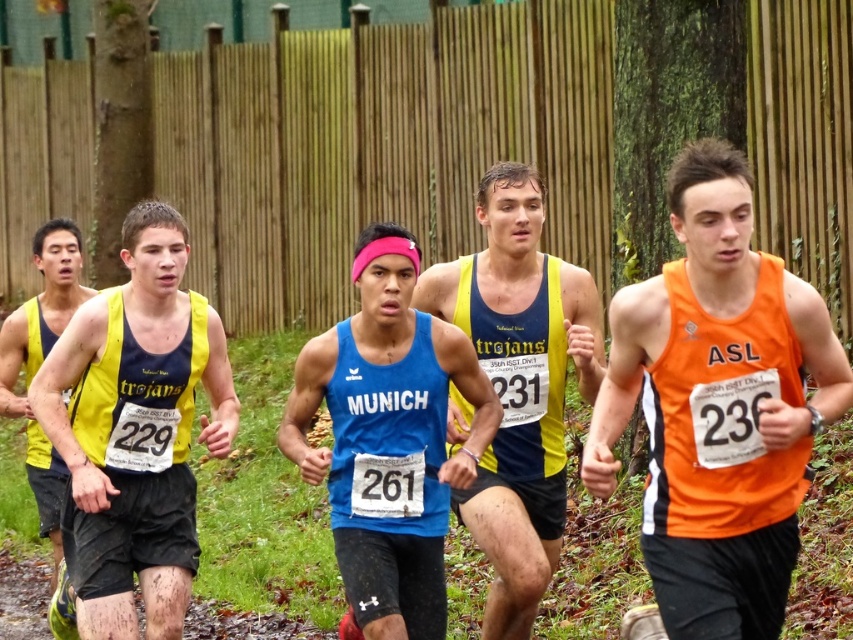
Question: Is yellow matte tank top at left positioned at the back of yellow fabric tank top at left?

Choices:
 (A) yes
 (B) no

Answer: (B)

Question: Which point is closer to the camera?

Choices:
 (A) tap(94, 289)
 (B) tap(416, 547)
 (C) tap(544, 358)
 (D) tap(62, 365)

Answer: (D)

Question: Considering the real-world distances, which object is closest to the blue fabric tank top at center?

Choices:
 (A) blue matte tank top at center
 (B) orange fabric tank top at right
 (C) yellow fabric tank top at left

Answer: (A)

Question: Which point is farther from the camera taking this photo?

Choices:
 (A) (465, 371)
 (B) (59, 355)
 (C) (724, 547)
 (D) (57, 332)

Answer: (D)

Question: Can you confirm if blue matte tank top at center is bigger than yellow fabric tank top at left?

Choices:
 (A) yes
 (B) no

Answer: (A)

Question: From the image, what is the correct spatial relationship of orange fabric tank top at right in relation to yellow fabric tank top at left?

Choices:
 (A) above
 (B) below

Answer: (A)